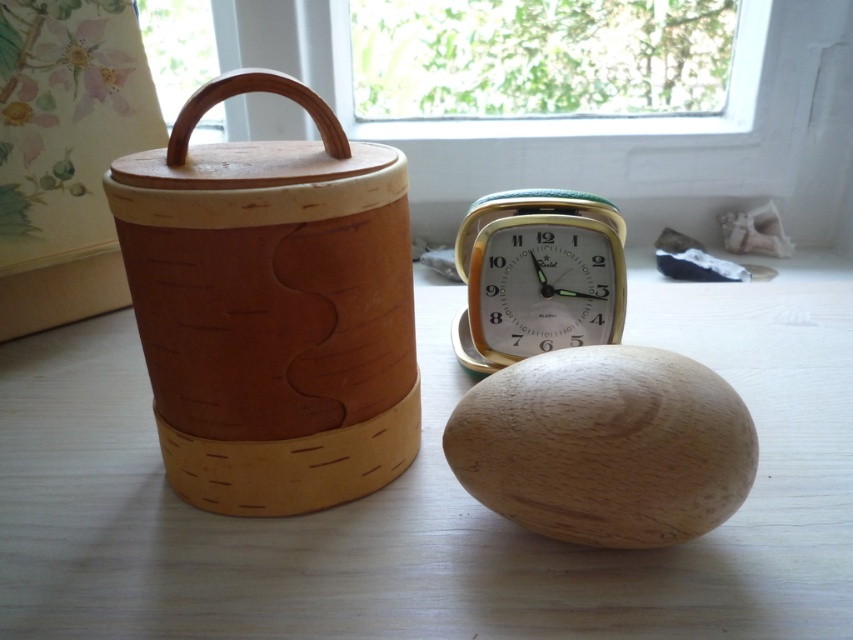
Does natural wood table at center come behind metallic gold alarm clock at center?

No, it is not.

Is natural wood table at center to the right of metallic gold alarm clock at center from the viewer's perspective?

Yes, natural wood table at center is to the right of metallic gold alarm clock at center.

Who is more distant from viewer, (x=44, y=563) or (x=500, y=221)?

Positioned behind is point (x=500, y=221).

The width and height of the screenshot is (853, 640). Identify the location of natural wood table at center. pyautogui.click(x=432, y=499).